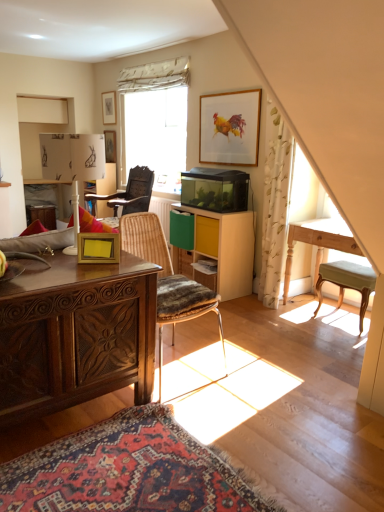
What are the coordinates of `blank space to the left of green fabric stool at right, the 1th chair when ordered from right to left` in the screenshot? It's located at (311, 320).